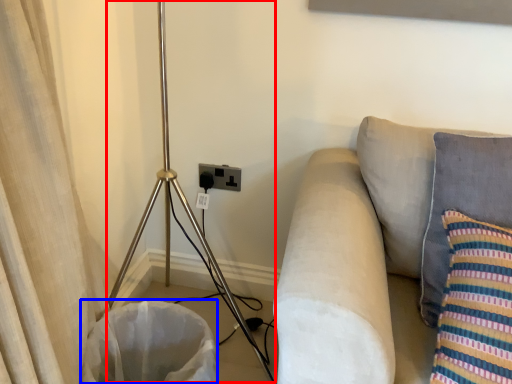
Question: Which object appears farthest to the camera in this image, tripod (highlighted by a red box) or laundry basket (highlighted by a blue box)?

Choices:
 (A) tripod
 (B) laundry basket

Answer: (B)